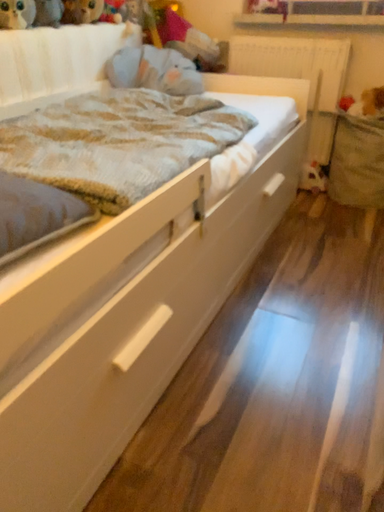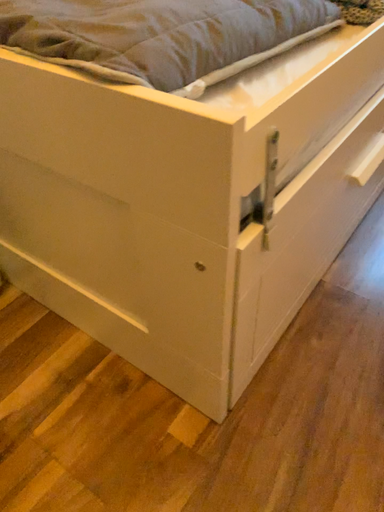
Question: How did the camera likely rotate when shooting the video?

Choices:
 (A) rotated right
 (B) rotated left

Answer: (B)